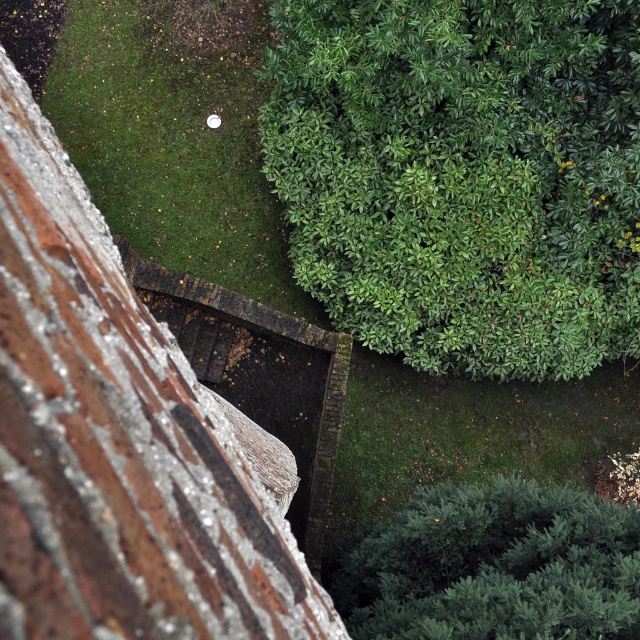
Question: Does smooth brick wall at center appear under green leafy hedge at lower right?

Choices:
 (A) no
 (B) yes

Answer: (A)

Question: Which of the following is the closest to the observer?

Choices:
 (A) (205, 618)
 (B) (547, 16)

Answer: (A)

Question: Is green leafy bush at upper right bigger than green leafy hedge at lower right?

Choices:
 (A) no
 (B) yes

Answer: (B)

Question: Which of the following is the closest to the observer?

Choices:
 (A) (4, 269)
 (B) (531, 586)
 (C) (356, 333)

Answer: (A)

Question: Considering the real-world distances, which object is closest to the green leafy hedge at lower right?

Choices:
 (A) green leafy bush at upper right
 (B) smooth brick wall at center

Answer: (A)

Question: Observing the image, what is the correct spatial positioning of smooth brick wall at center in reference to green leafy hedge at lower right?

Choices:
 (A) above
 (B) below

Answer: (A)